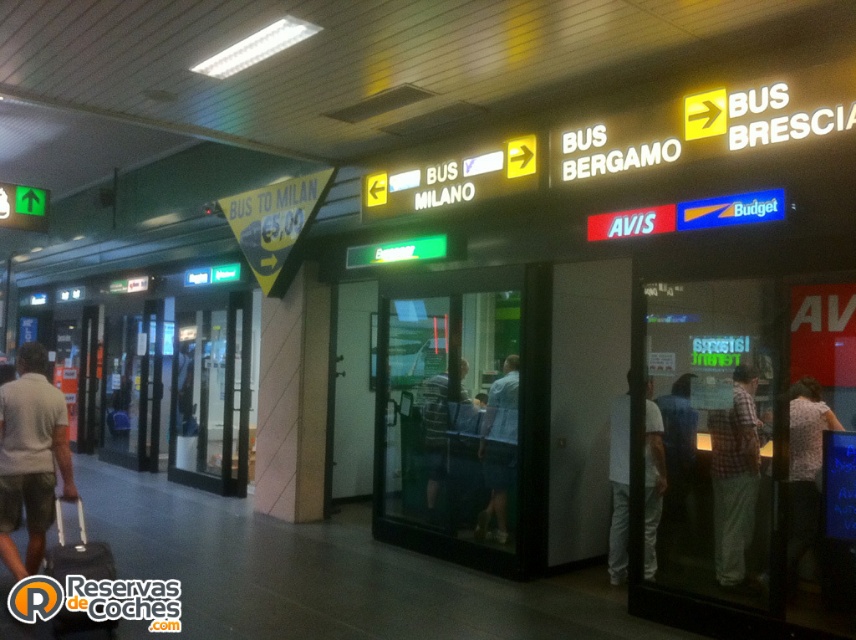
Does point (736, 426) lie behind point (88, 560)?

Yes.

Can you confirm if plaid shirt at center is bigger than black fabric suitcase at lower left?

Actually, plaid shirt at center might be smaller than black fabric suitcase at lower left.

Between point (728, 433) and point (74, 541), which one is positioned in front?

Point (728, 433) is in front.

This screenshot has width=856, height=640. Find the location of `plaid shirt at center`. plaid shirt at center is located at coordinates (734, 476).

Which is behind, point (616, 428) or point (438, 380)?

Positioned behind is point (438, 380).

Does white matte shirt at center have a larger size compared to striped shirt at center?

Actually, white matte shirt at center might be smaller than striped shirt at center.

I want to click on white matte shirt at center, so click(617, 486).

The height and width of the screenshot is (640, 856). I want to click on white matte shirt at center, so click(617, 486).

Between point (712, 492) and point (810, 445), which one is positioned in front?

Point (712, 492) is more forward.

Between plaid shirt at center and white shirt at right, which one appears on the left side from the viewer's perspective?

plaid shirt at center is more to the left.

Between point (714, 516) and point (819, 467), which one is positioned behind?

The point (819, 467) is more distant.

You are a GUI agent. You are given a task and a screenshot of the screen. Output one action in this format:
    pyautogui.click(x=<x>, y=<y>)
    Task: Click on the plaid shirt at center
    This screenshot has width=856, height=640.
    Given the screenshot: What is the action you would take?
    pyautogui.click(x=734, y=476)